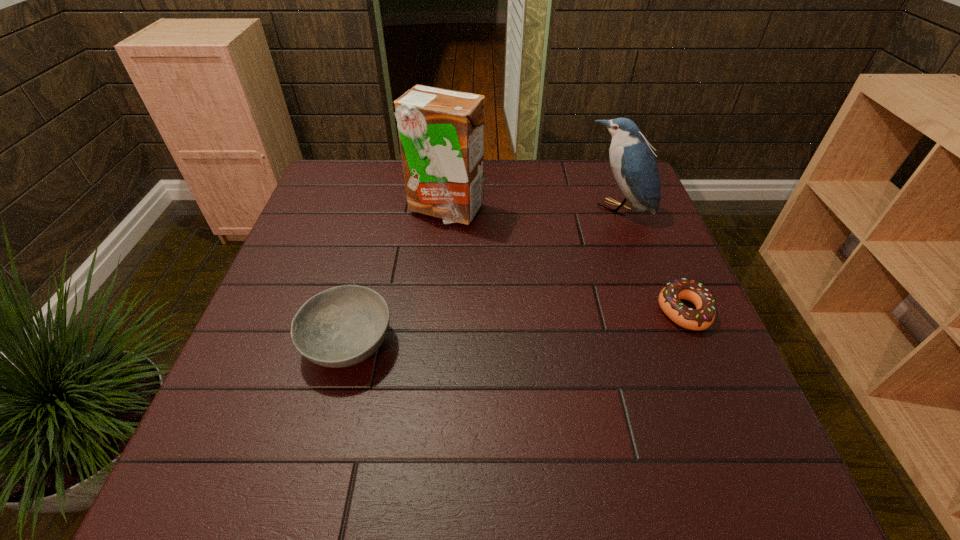
The height and width of the screenshot is (540, 960). What are the coordinates of `vacant space on the desktop that is between the third tallest object and the doughnut and is positioned at the tip of the bird's beak` in the screenshot? It's located at (494, 329).

I want to click on free space on the desktop that is between the third tallest object and the shortest object and is positioned on the straw side of the tallest object, so click(507, 328).